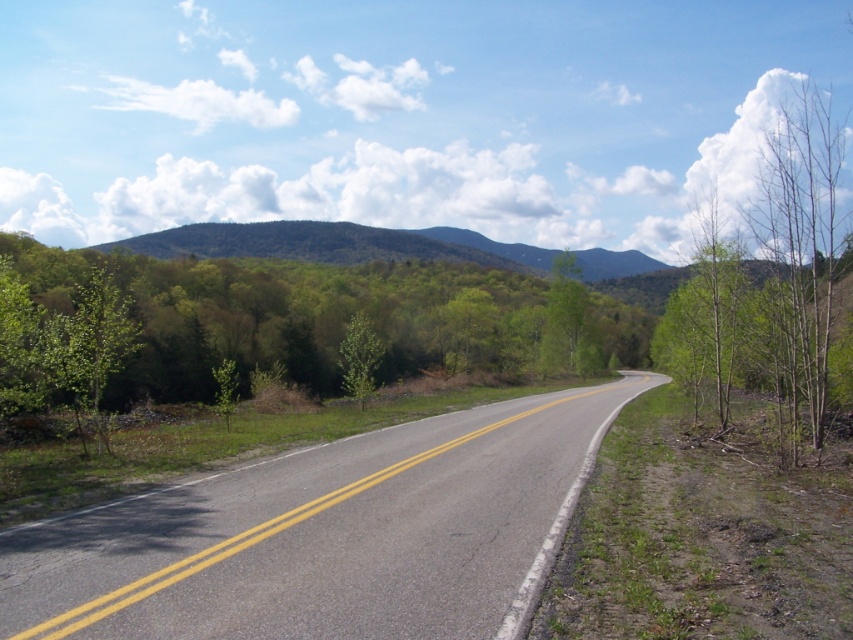
Question: Is asphalt road at center smaller than green leafy tree at left?

Choices:
 (A) yes
 (B) no

Answer: (A)

Question: Which point is closer to the camera?

Choices:
 (A) (552, 288)
 (B) (136, 323)

Answer: (B)

Question: Can you confirm if asphalt road at center is smaller than green matte tree at center?

Choices:
 (A) no
 (B) yes

Answer: (A)

Question: Does green leafy tree at left appear on the left side of green matte tree at center?

Choices:
 (A) yes
 (B) no

Answer: (A)

Question: Which object is farther from the camera taking this photo?

Choices:
 (A) asphalt road at center
 (B) green leafy tree at center
 (C) green leafy tree at left

Answer: (B)

Question: Which point appears closest to the camera in this image?

Choices:
 (A) (368, 340)
 (B) (51, 362)
 (C) (155, 532)

Answer: (C)